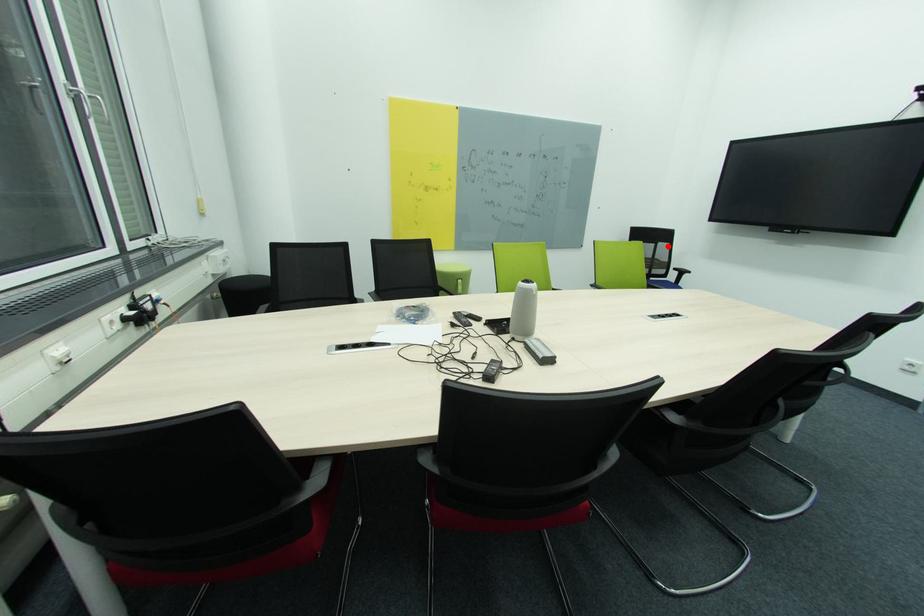
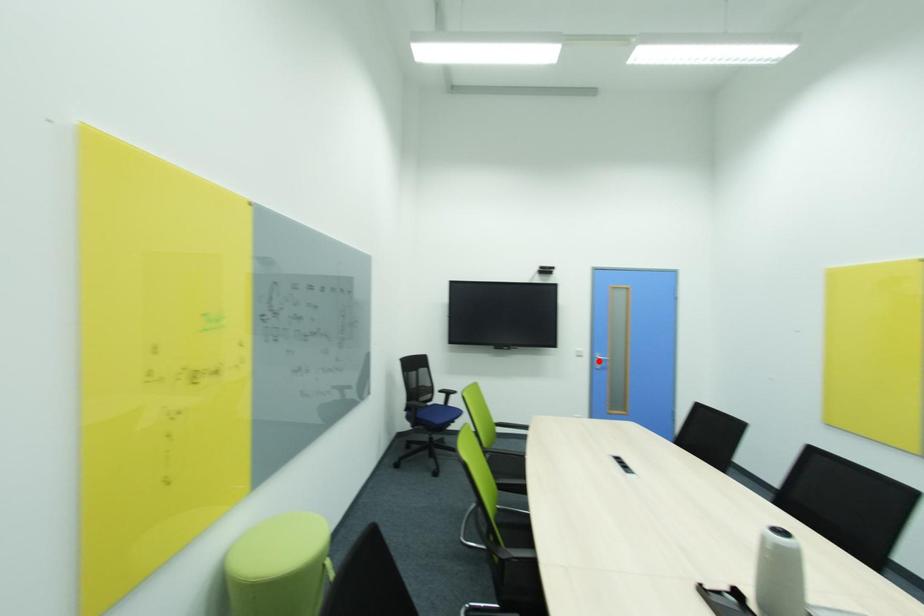
I am providing you with two images of the same scene from different viewpoints. A red point is marked on the first image and another point is marked on the second image. Is the red point in image1 aligned with the point shown in image2?

No